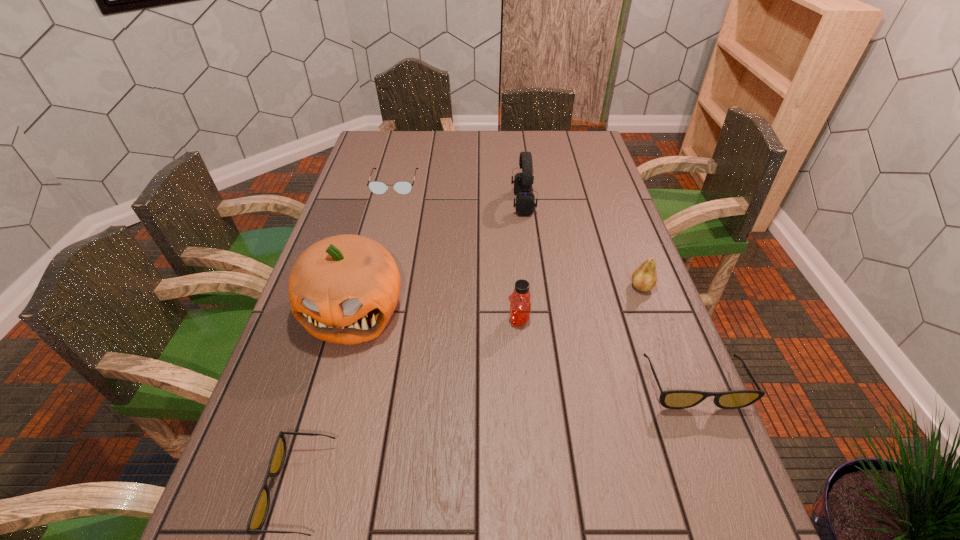
The width and height of the screenshot is (960, 540). I want to click on unoccupied area between the fifth tallest object and the pear, so click(667, 336).

Find the location of a particular element. unoccupied position between the fifth tallest object and the pear is located at coordinates (667, 336).

You are a GUI agent. You are given a task and a screenshot of the screen. Output one action in this format:
    pyautogui.click(x=<x>, y=<y>)
    Task: Click on the free area in between the spectacles and the headset
    Image resolution: width=960 pixels, height=540 pixels.
    Given the screenshot: What is the action you would take?
    pyautogui.click(x=459, y=193)

The image size is (960, 540). What are the coordinates of `object that is the third closest to the pear` in the screenshot? It's located at (525, 200).

The width and height of the screenshot is (960, 540). I want to click on object that ranks as the sixth closest to the spectacles, so click(x=672, y=399).

Identify the location of free space in the image that satisfies the following two spatial constraints: 1. on the headband of the headset; 2. on the face of the tallest object. This screenshot has height=540, width=960. (537, 312).

Identify the location of vacant space that satisfies the following two spatial constraints: 1. on the headband of the second tallest object; 2. on the back side of the pear. (533, 287).

Locate an element on the screen. The height and width of the screenshot is (540, 960). free space that satisfies the following two spatial constraints: 1. on the headband of the sixth shortest object; 2. on the face of the pumpkin is located at coordinates (537, 312).